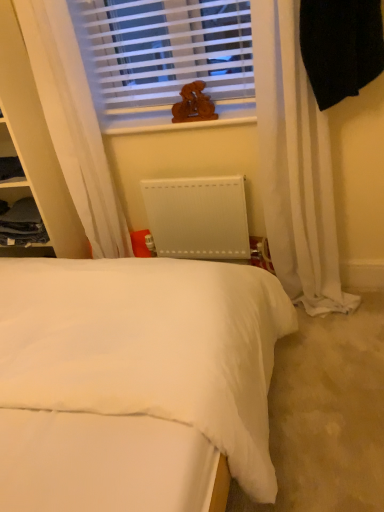
Question: From a real-world perspective, does wooden carving at upper center stand above white soft bed at center?

Choices:
 (A) no
 (B) yes

Answer: (B)

Question: Considering the relative sizes of wooden carving at upper center and white soft bed at center in the image provided, is wooden carving at upper center shorter than white soft bed at center?

Choices:
 (A) no
 (B) yes

Answer: (B)

Question: Considering the relative sizes of wooden carving at upper center and white soft bed at center in the image provided, is wooden carving at upper center smaller than white soft bed at center?

Choices:
 (A) no
 (B) yes

Answer: (B)

Question: Are wooden carving at upper center and white soft bed at center beside each other?

Choices:
 (A) yes
 (B) no

Answer: (B)

Question: Is wooden carving at upper center outside of white soft bed at center?

Choices:
 (A) no
 (B) yes

Answer: (B)

Question: Considering the relative sizes of wooden carving at upper center and white soft bed at center in the image provided, is wooden carving at upper center bigger than white soft bed at center?

Choices:
 (A) yes
 (B) no

Answer: (B)

Question: From a real-world perspective, is white matte radiator at center located higher than white sheer curtain at upper left?

Choices:
 (A) no
 (B) yes

Answer: (A)

Question: Is white matte radiator at center oriented towards white sheer curtain at upper left?

Choices:
 (A) no
 (B) yes

Answer: (A)

Question: Can you confirm if white matte radiator at center is taller than white sheer curtain at upper left?

Choices:
 (A) no
 (B) yes

Answer: (A)

Question: Is white matte radiator at center with white sheer curtain at upper left?

Choices:
 (A) yes
 (B) no

Answer: (B)

Question: Is white matte radiator at center facing away from white sheer curtain at upper left?

Choices:
 (A) no
 (B) yes

Answer: (A)

Question: Is white matte radiator at center thinner than white sheer curtain at upper left?

Choices:
 (A) no
 (B) yes

Answer: (B)

Question: Considering the relative sizes of dark gray fabric cabinet at left and white sheer curtain at upper left in the image provided, is dark gray fabric cabinet at left taller than white sheer curtain at upper left?

Choices:
 (A) yes
 (B) no

Answer: (B)